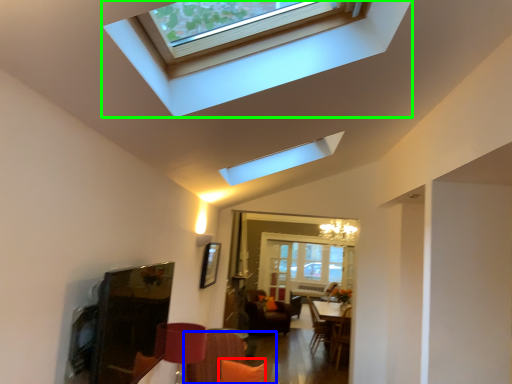
Question: Which object is positioned closest to pillow (highlighted by a red box)? Select from couch (highlighted by a blue box) and window (highlighted by a green box).

Choices:
 (A) couch
 (B) window

Answer: (A)